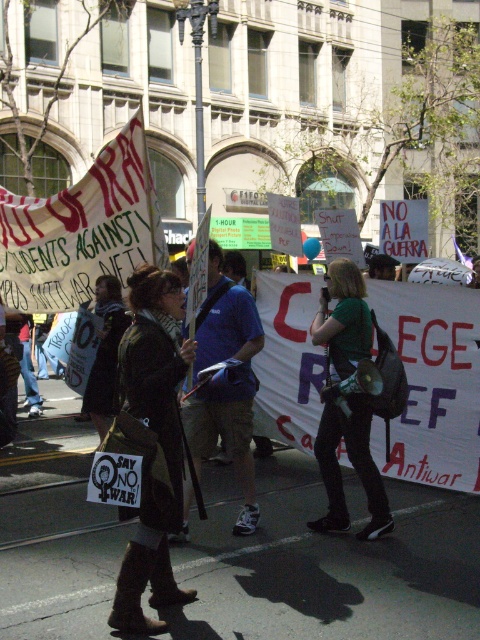
You are a photographer at the protest scene. You want to capture a photo that includes both the blue fabric shirt at center and the green matte shirt at center. Which shirt should you focus on first to ensure both are in the frame?

The blue fabric shirt at center is above the green matte shirt at center, so focus on the blue fabric shirt at center first to ensure both are in the frame.

What is the spatial relationship between the dark brown leather boots at center and the green matte shirt at center in the protest scene?

The dark brown leather boots at center are positioned to the left of the green matte shirt at center.